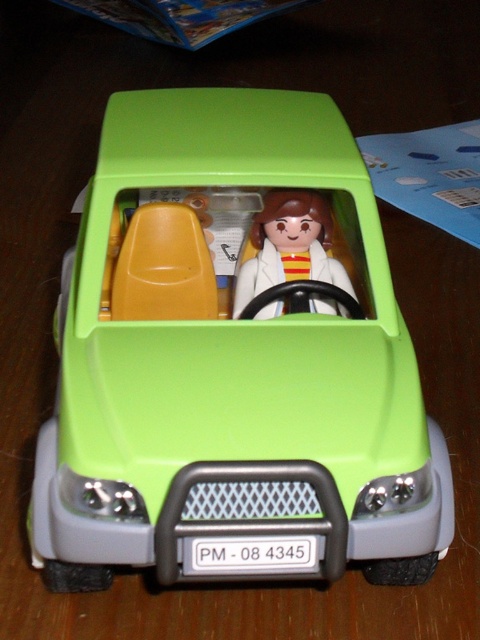
From the picture: You are setting up a display for a toy store. You have a lime matte toy car at center and a matte plastic figure at center. The store manager wants to know if the car will block the view of the figure when placed side by side on the shelf. Can you determine this based on their sizes?

The lime matte toy car at center is taller than the matte plastic figure at center, so it may block the view of the figure if placed directly in front of it on the shelf.

What are the coordinates of the lime matte toy car at center?

The lime matte toy car at center is located at point (233, 362).